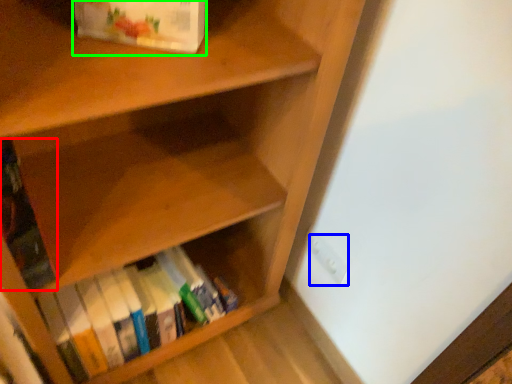
Question: Estimate the real-world distances between objects in this image. Which object is closer to book (highlighted by a red box), electric outlet (highlighted by a blue box) or book (highlighted by a green box)?

Choices:
 (A) electric outlet
 (B) book

Answer: (B)